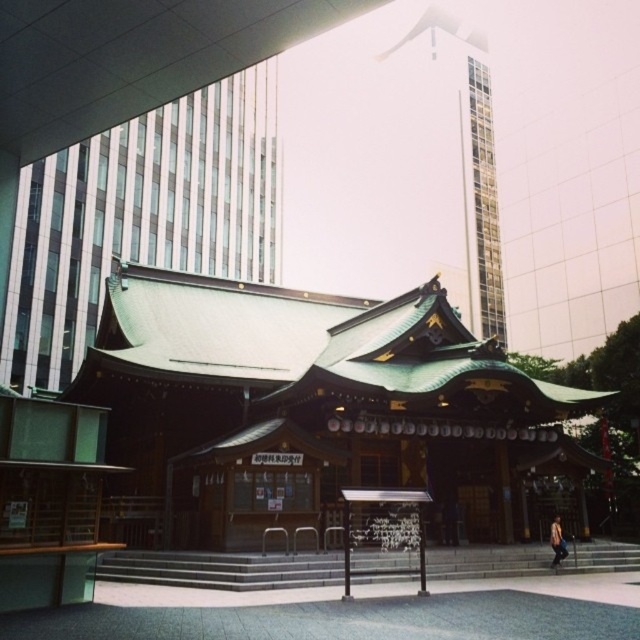
Question: Is green shingled roof at upper left thinner than green shingled roof at upper center?

Choices:
 (A) no
 (B) yes

Answer: (A)

Question: From the image, what is the correct spatial relationship of green shingled roof at upper left in relation to green shingled roof at upper center?

Choices:
 (A) above
 (B) below

Answer: (B)

Question: Considering the relative positions of green shingled roof at upper left and green shingled roof at upper center in the image provided, where is green shingled roof at upper left located with respect to green shingled roof at upper center?

Choices:
 (A) left
 (B) right

Answer: (A)

Question: Which point is closer to the camera?

Choices:
 (A) (401, 42)
 (B) (6, 324)

Answer: (B)